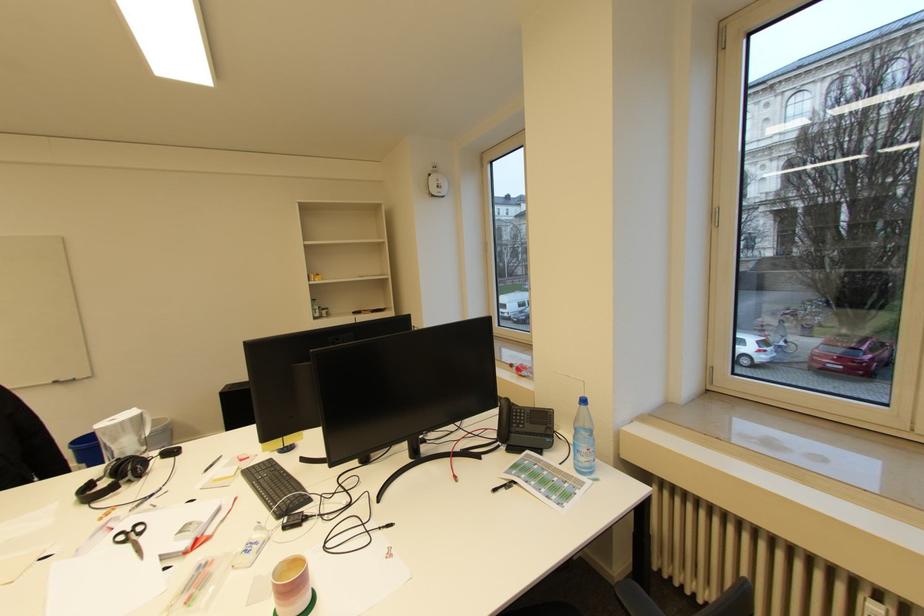
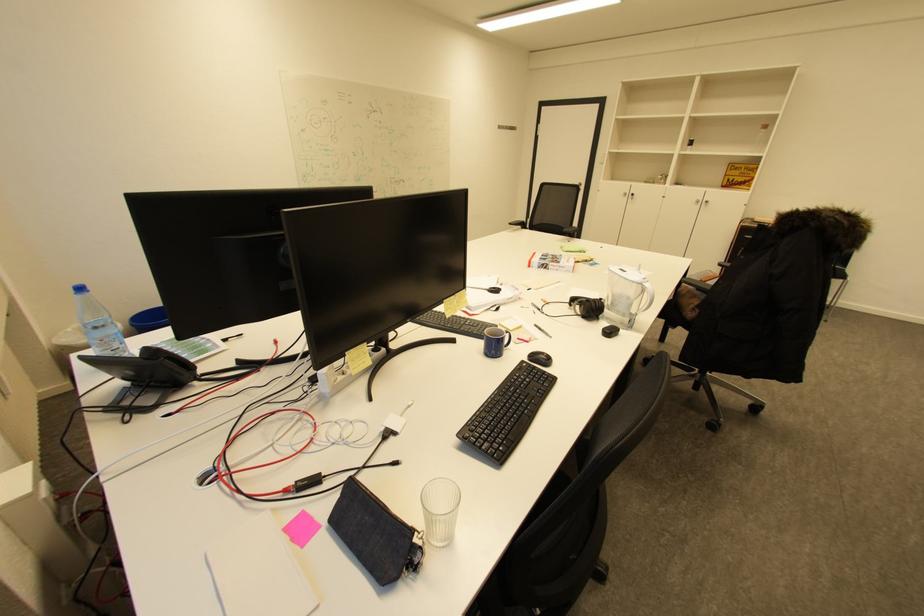
In the second image, find the point that corresponds to point (590, 400) in the first image.

(88, 290)